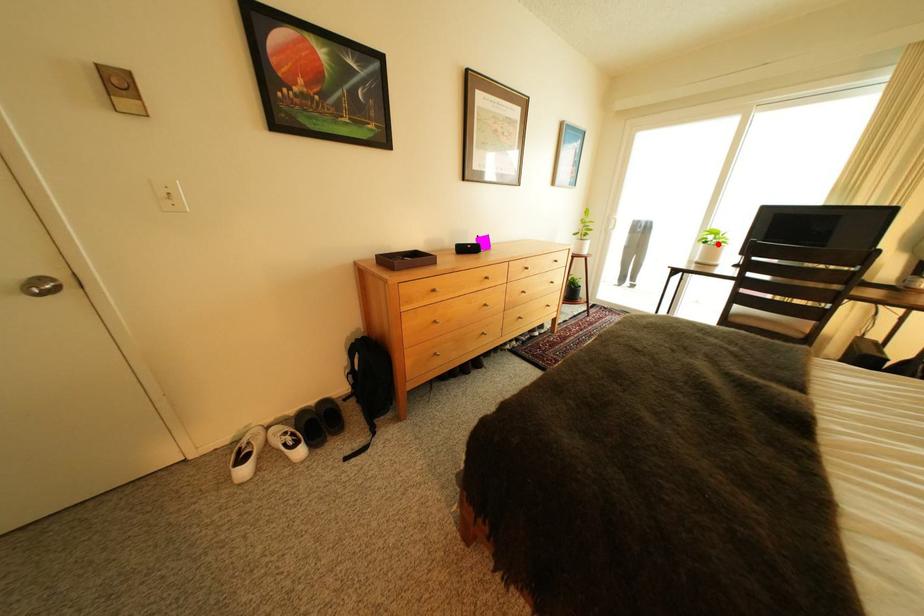
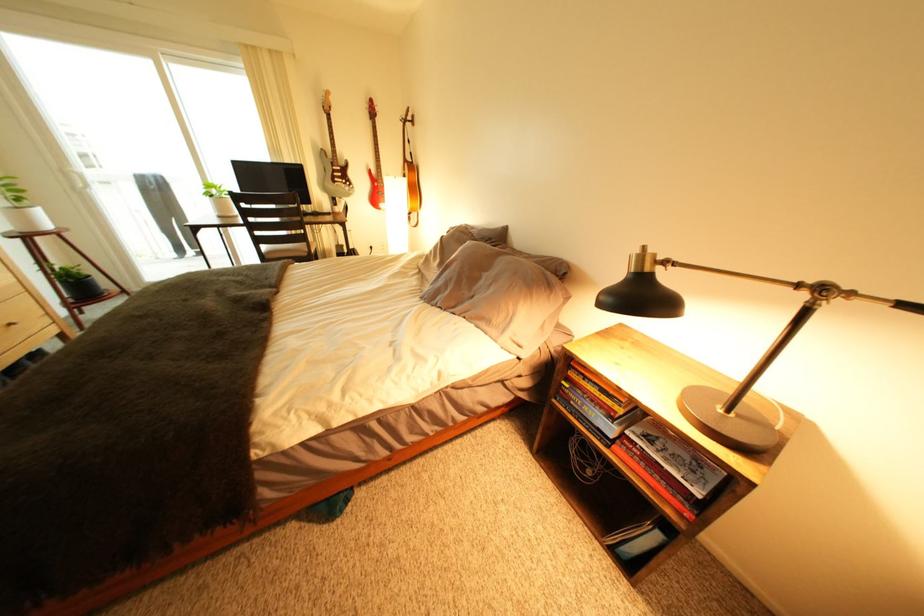
Where in the second image is the point corresponding to the highlighted location from the first image?

(225, 198)